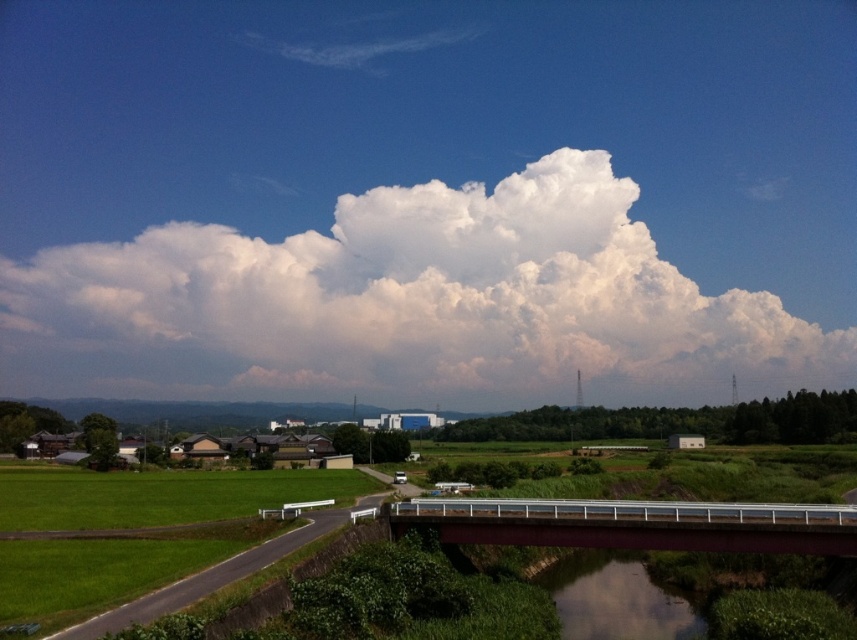
Which is below, metallic gray bridge at center or green grass at lower left?

green grass at lower left is below.

Which is behind, point (800, 550) or point (300, 538)?

The point (300, 538) is more distant.

Where is `metallic gray bridge at center`? The height and width of the screenshot is (640, 857). metallic gray bridge at center is located at coordinates (633, 524).

Which is more to the right, smooth brown water at bottom center or silver metallic train at center?

smooth brown water at bottom center is more to the right.

The image size is (857, 640). Identify the location of smooth brown water at bottom center. (615, 600).

Image resolution: width=857 pixels, height=640 pixels. Find the location of `smooth brown water at bottom center`. smooth brown water at bottom center is located at coordinates (615, 600).

The width and height of the screenshot is (857, 640). Identify the location of smooth brown water at bottom center. (615, 600).

Is metallic gray bridge at center taller than smooth brown water at bottom center?

No, metallic gray bridge at center is not taller than smooth brown water at bottom center.

Does metallic gray bridge at center have a smaller size compared to smooth brown water at bottom center?

Yes.

Where is `metallic gray bridge at center`? The height and width of the screenshot is (640, 857). metallic gray bridge at center is located at coordinates (633, 524).